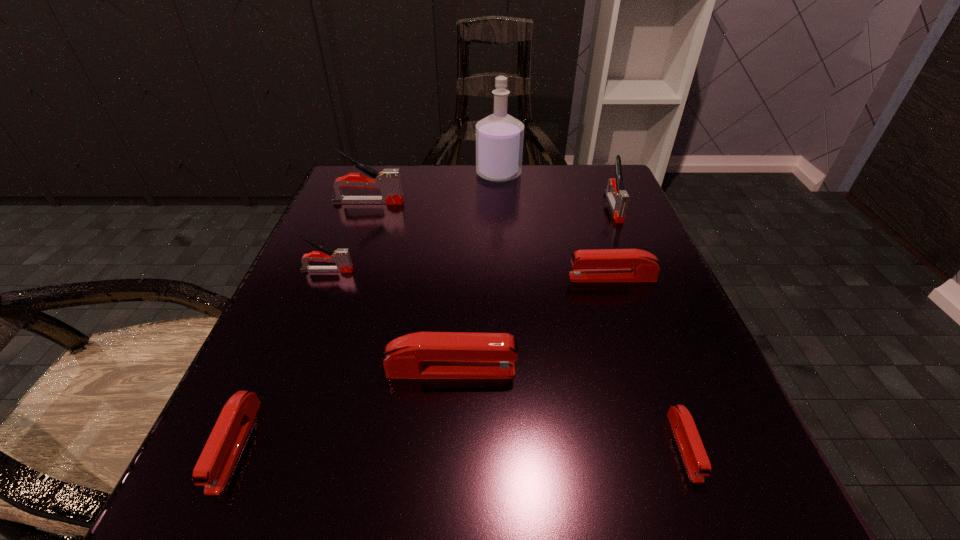
Where is `purple perfume`? This screenshot has height=540, width=960. purple perfume is located at coordinates (499, 137).

At what (x,y) coordinates should I click in order to perform the action: click on perfume. Please return your answer as a coordinate pair (x, y). The image size is (960, 540). Looking at the image, I should click on (499, 137).

Identify the location of the seventh shortest object. This screenshot has height=540, width=960. (388, 181).

In order to click on the tallest stapler in this screenshot , I will do click(x=388, y=181).

Find the location of `the third tallest object`. the third tallest object is located at coordinates (618, 198).

The height and width of the screenshot is (540, 960). I want to click on the second biggest gray stapler, so click(x=618, y=198).

Where is `the smallest gray stapler`? This screenshot has height=540, width=960. the smallest gray stapler is located at coordinates click(x=341, y=256).

Locate an element on the screen. the sixth farthest object is located at coordinates (423, 355).

At what (x,y) coordinates should I click in order to perform the action: click on the fourth stapler from left to right. Please return your answer as a coordinate pair (x, y). The height and width of the screenshot is (540, 960). Looking at the image, I should click on (423, 355).

In order to click on the second biggest red stapler in this screenshot , I will do `click(600, 265)`.